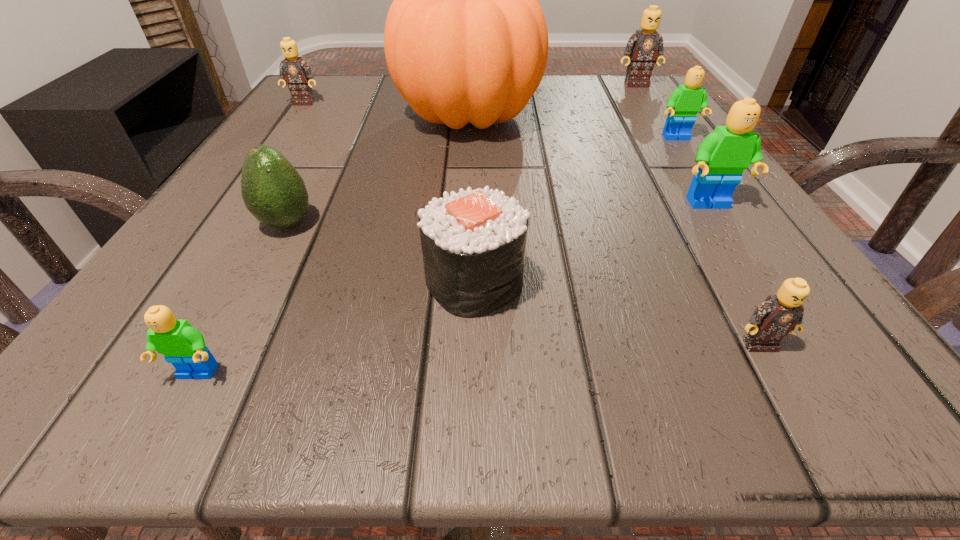
Locate an element on the screen. This screenshot has width=960, height=540. vacant area that lies between the pumpkin and the nearest tan Lego is located at coordinates (612, 230).

Locate an element on the screen. vacant region between the green avocado and the fifth Lego from right to left is located at coordinates (242, 299).

Identify the location of free space between the third nearest object and the avocado. pyautogui.click(x=380, y=253).

The image size is (960, 540). In order to click on unoccupied area between the biggest green Lego and the sushi in this screenshot , I will do `click(591, 244)`.

Identify the location of object that ranks as the second closest to the nearest object. This screenshot has height=540, width=960. (273, 191).

Where is `object that can be found as the second closest to the third nearest Lego`? object that can be found as the second closest to the third nearest Lego is located at coordinates (465, 39).

Locate which Lego ranks fourth in proximity to the green avocado. Please provide its 2D coordinates. Your answer should be formatted as a tuple, i.e. [(x, y)], where the tuple contains the x and y coordinates of a point satisfying the conditions above.

[(778, 315)]

Identify which Lego is located as the second nearest to the second smallest tan Lego. Please provide its 2D coordinates. Your answer should be formatted as a tuple, i.e. [(x, y)], where the tuple contains the x and y coordinates of a point satisfying the conditions above.

[(183, 346)]

Where is `tan Lego that is the closest one to the sushi`? The height and width of the screenshot is (540, 960). tan Lego that is the closest one to the sushi is located at coordinates (778, 315).

Identify the location of the third closest tan Lego to the avocado. (643, 47).